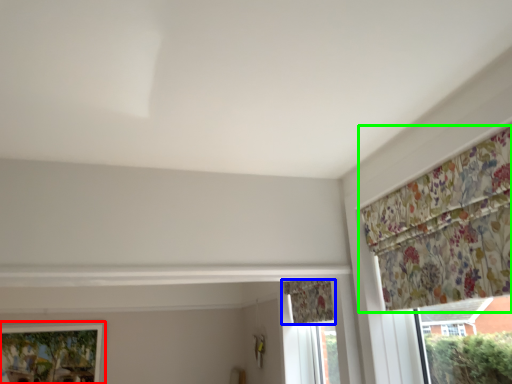
Question: Based on their relative distances, which object is farther from window (highlighted by a red box)? Choose from curtain (highlighted by a blue box) and curtain (highlighted by a green box).

Choices:
 (A) curtain
 (B) curtain

Answer: (B)